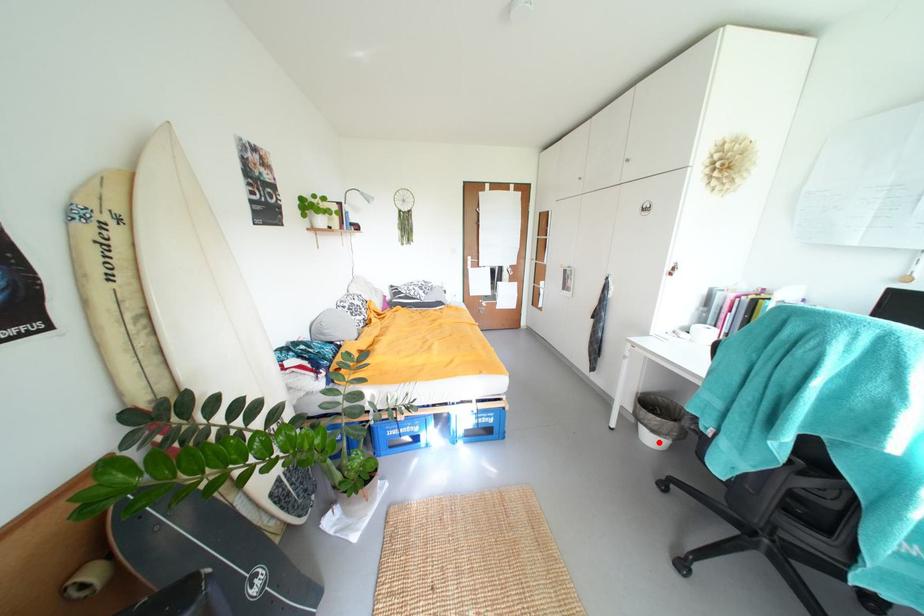
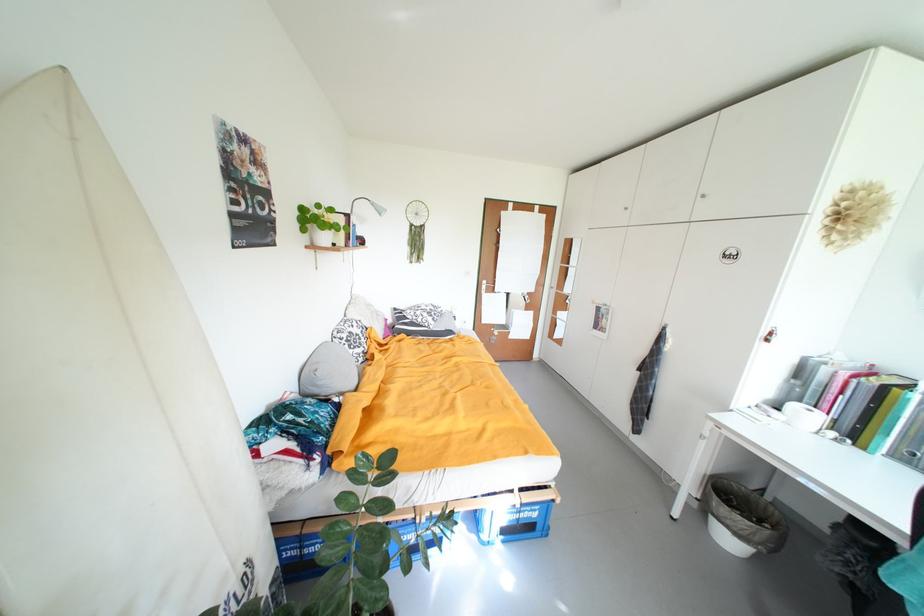
Question: A red point is marked in image1. In image2, is the corresponding 3D point closer to the camera or farther? Reply with the corresponding letter.

Choices:
 (A) The corresponding 3D point is closer.
 (B) The corresponding 3D point is farther.

Answer: (B)